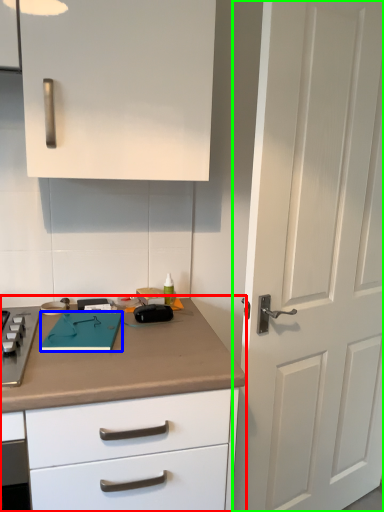
Question: Which object is the closest to the countertop (highlighted by a red box)? Choose among these: notepad (highlighted by a blue box) or door (highlighted by a green box).

Choices:
 (A) notepad
 (B) door

Answer: (A)